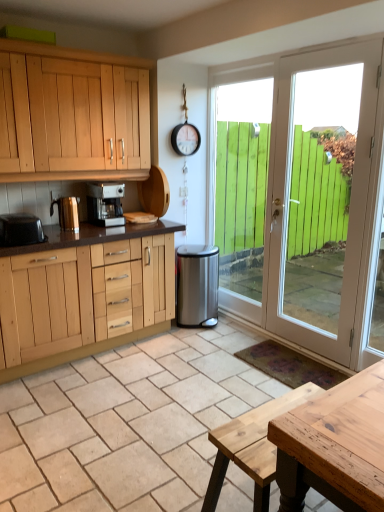
Question: Considering the relative sizes of natural stone tile at center and polished gold kettle at left, placed as the 2th appliance when sorted from front to back, in the image provided, is natural stone tile at center taller than polished gold kettle at left, placed as the 2th appliance when sorted from front to back,?

Choices:
 (A) no
 (B) yes

Answer: (A)

Question: Is the surface of natural stone tile at center in direct contact with polished gold kettle at left, the 2th appliance viewed from the left?

Choices:
 (A) no
 (B) yes

Answer: (A)

Question: From a real-world perspective, is natural stone tile at center beneath polished gold kettle at left, placed as the 2th appliance when sorted from front to back?

Choices:
 (A) yes
 (B) no

Answer: (A)

Question: Is natural stone tile at center looking in the opposite direction of polished gold kettle at left, the 2th appliance viewed from the left?

Choices:
 (A) yes
 (B) no

Answer: (B)

Question: Can you confirm if natural stone tile at center is wider than polished gold kettle at left, the 2th appliance positioned from the right?

Choices:
 (A) yes
 (B) no

Answer: (A)

Question: Does natural stone tile at center have a smaller size compared to polished gold kettle at left, placed as the 2th appliance when sorted from front to back?

Choices:
 (A) no
 (B) yes

Answer: (A)

Question: Does satin silver coffee machine at upper center have a lesser width compared to white wood door at right?

Choices:
 (A) yes
 (B) no

Answer: (B)

Question: Does satin silver coffee machine at upper center appear on the right side of white wood door at right?

Choices:
 (A) yes
 (B) no

Answer: (B)

Question: Is satin silver coffee machine at upper center facing towards white wood door at right?

Choices:
 (A) yes
 (B) no

Answer: (B)

Question: Is satin silver coffee machine at upper center touching white wood door at right?

Choices:
 (A) no
 (B) yes

Answer: (A)

Question: Does satin silver coffee machine at upper center have a greater width compared to white wood door at right?

Choices:
 (A) yes
 (B) no

Answer: (A)

Question: Is satin silver coffee machine at upper center positioned beyond the bounds of white wood door at right?

Choices:
 (A) yes
 (B) no

Answer: (A)

Question: Is black plastic toaster at left, which is counted as the 3th appliance, starting from the right, bigger than satin silver coffee machine at upper center?

Choices:
 (A) no
 (B) yes

Answer: (A)